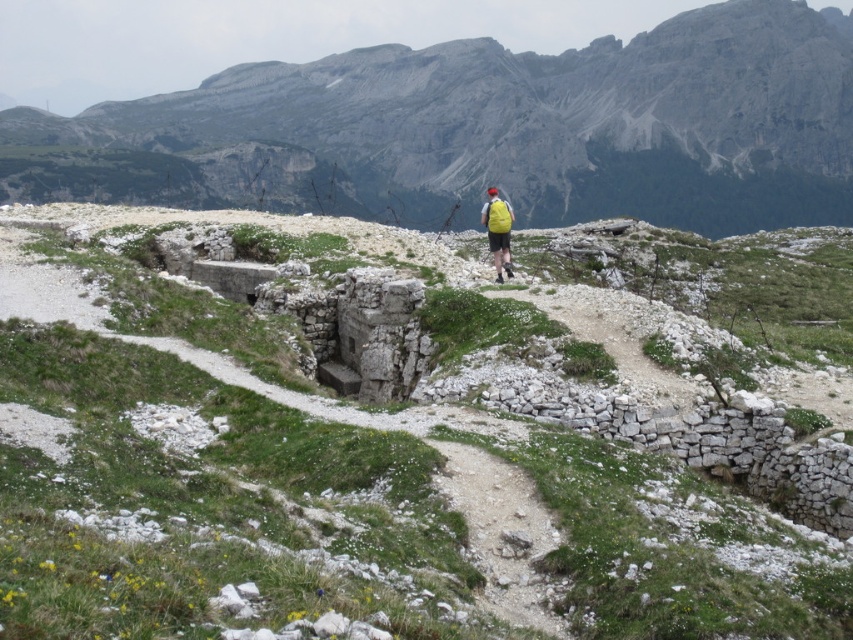
Does gray rocky mountain at upper center have a larger size compared to yellow fabric backpack at center?

Indeed, gray rocky mountain at upper center has a larger size compared to yellow fabric backpack at center.

Which of these two, gray rocky mountain at upper center or yellow fabric backpack at center, stands shorter?

With less height is yellow fabric backpack at center.

Is point (561, 145) closer to camera compared to point (496, 228)?

No, it is not.

The image size is (853, 640). Identify the location of gray rocky mountain at upper center. (492, 129).

Is white stone path at center above gray rocky mountain at upper center?

Incorrect, white stone path at center is not positioned above gray rocky mountain at upper center.

Consider the image. Is white stone path at center to the right of gray rocky mountain at upper center from the viewer's perspective?

Correct, you'll find white stone path at center to the right of gray rocky mountain at upper center.

This screenshot has height=640, width=853. Describe the element at coordinates (370, 456) in the screenshot. I see `white stone path at center` at that location.

The image size is (853, 640). What are the coordinates of `white stone path at center` in the screenshot? It's located at (370, 456).

Does white stone path at center appear on the left side of yellow fabric backpack at center?

Indeed, white stone path at center is positioned on the left side of yellow fabric backpack at center.

Looking at this image, does white stone path at center have a greater height compared to yellow fabric backpack at center?

In fact, white stone path at center may be shorter than yellow fabric backpack at center.

Is point (299, 273) closer to camera compared to point (498, 228)?

Yes, point (299, 273) is closer to viewer.

Find the location of a particular element. white stone path at center is located at coordinates (370, 456).